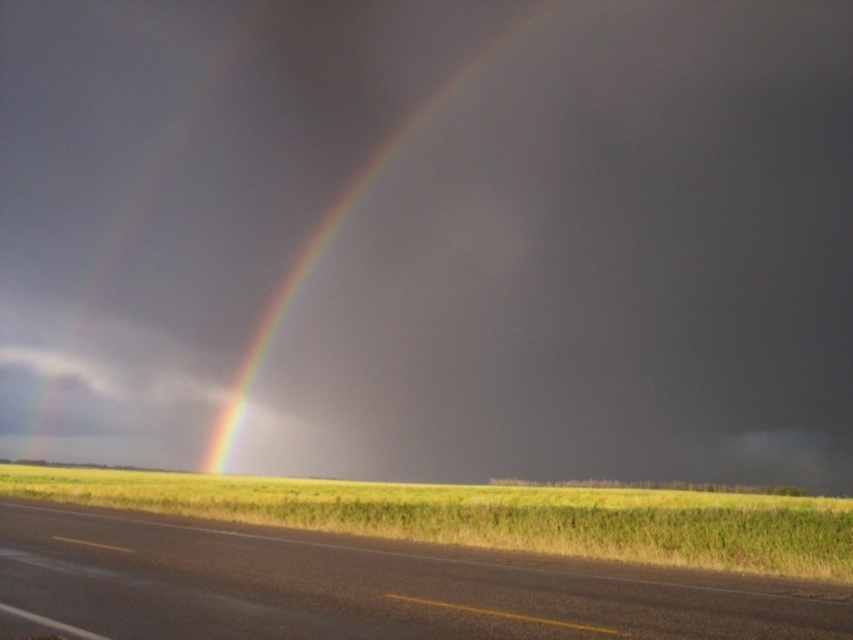
You are a photographer standing on the asphalt road at lower center and want to capture the glossy rainbow at center in your photo. Can you see the entire rainbow above you from your current position?

The asphalt road at lower center is located below the glossy rainbow at center, so yes, you can see the entire rainbow above you from your current position on the asphalt road at lower center.